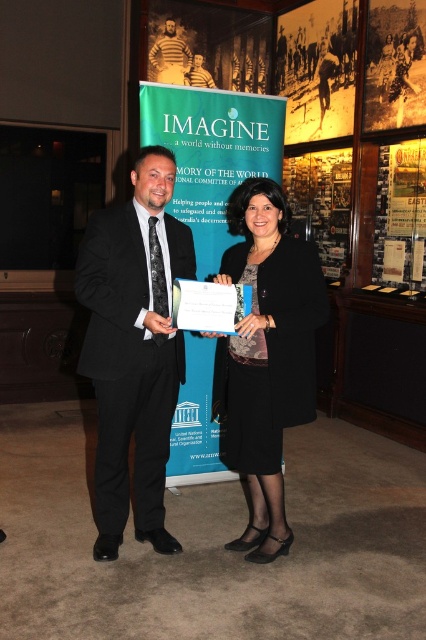
Consider the image. Which is above, blue paper at center or metallic gold plaque at upper right?

Positioned higher is metallic gold plaque at upper right.

Is blue paper at center in front of metallic gold plaque at upper right?

Yes, blue paper at center is in front of metallic gold plaque at upper right.

Find the location of a particular element. The image size is (426, 640). blue paper at center is located at coordinates (212, 154).

Identify the location of black suit at center. click(134, 349).

Who is taller, black suit at center or yellow striped sweater at upper center?

black suit at center is taller.

Image resolution: width=426 pixels, height=640 pixels. Describe the element at coordinates (134, 349) in the screenshot. I see `black suit at center` at that location.

The height and width of the screenshot is (640, 426). I want to click on black suit at center, so click(x=134, y=349).

Who is higher up, blue paper at center or yellow paper at upper center?

yellow paper at upper center is above.

The height and width of the screenshot is (640, 426). Describe the element at coordinates (212, 154) in the screenshot. I see `blue paper at center` at that location.

Is point (170, 200) farther from camera compared to point (310, 32)?

No, it is in front of (310, 32).

What are the coordinates of `blue paper at center` in the screenshot? It's located at (212, 154).